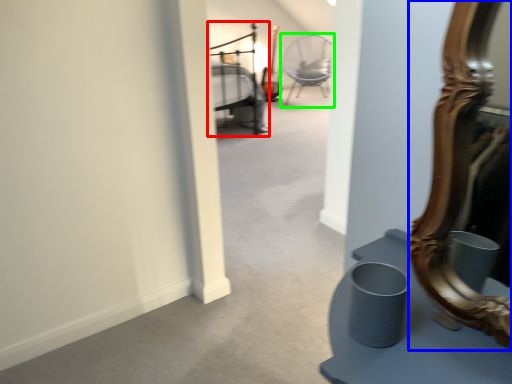
Question: Considering the real-world distances, which object is farthest from bed (highlighted by a red box)? mirror (highlighted by a blue box) or chair (highlighted by a green box)?

Choices:
 (A) mirror
 (B) chair

Answer: (A)